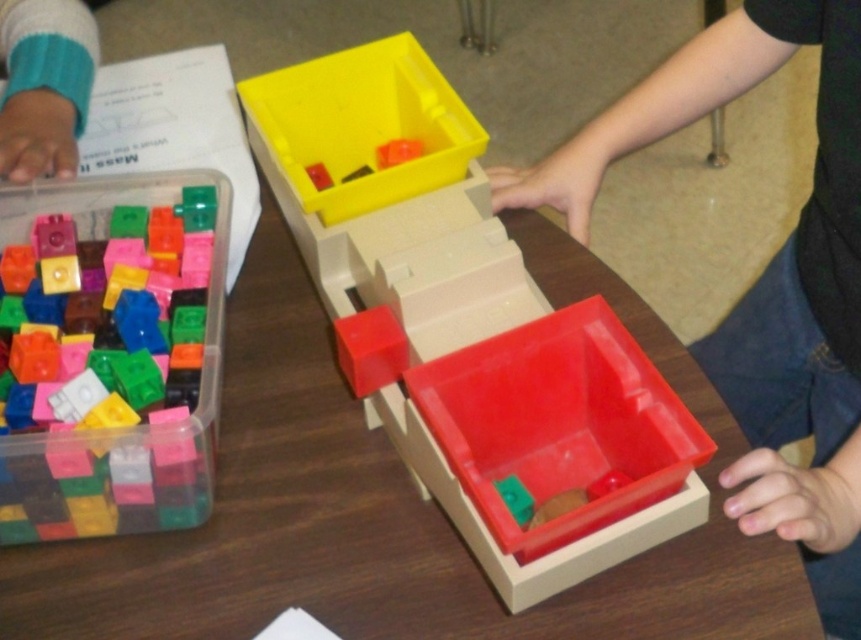
Which of these two, red plastic box at center or translucent plastic blocks at left, stands taller?

With more height is translucent plastic blocks at left.

Who is more forward, (711, 449) or (191, 476)?

Positioned in front is point (711, 449).

Where is `red plastic box at center`? This screenshot has width=861, height=640. red plastic box at center is located at coordinates (555, 448).

Is point (19, 493) closer to viewer compared to point (401, 140)?

Yes.

Can you confirm if translucent plastic blocks at left is positioned to the left of translucent plastic cube at upper center?

Correct, you'll find translucent plastic blocks at left to the left of translucent plastic cube at upper center.

At what (x,y) coordinates should I click in order to perform the action: click on translucent plastic blocks at left. Please return your answer as a coordinate pair (x, y). Looking at the image, I should click on click(x=115, y=428).

In order to click on translucent plastic blocks at left in this screenshot , I will do `click(115, 428)`.

Can you confirm if translucent plastic blocks at left is shorter than yellow plastic box at upper center?

Incorrect, translucent plastic blocks at left's height does not fall short of yellow plastic box at upper center's.

Between point (205, 512) and point (389, 115), which one is positioned in front?

Point (205, 512) is more forward.

Locate an element on the screen. The height and width of the screenshot is (640, 861). translucent plastic blocks at left is located at coordinates (115, 428).